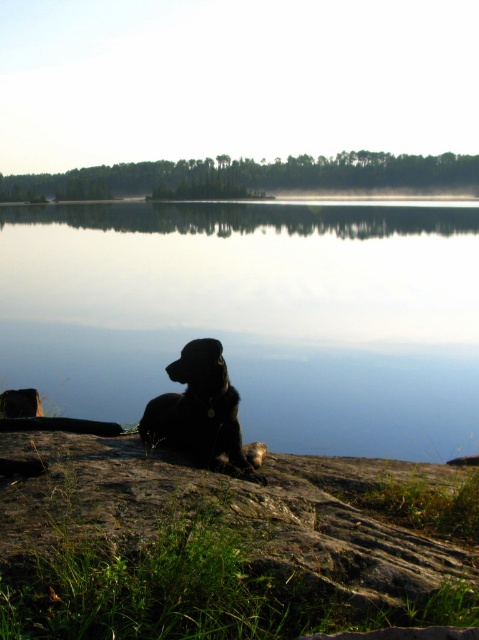
You are standing at the edge of the scene and want to place a small decorative stone on the ground so that it is visible above both the transparent water at center and the rough textured rock at lower center. Is this possible?

The transparent water at center is located above the rough textured rock at lower center, so placing a small decorative stone to be visible above both would require positioning it higher than the transparent water at center. However, since the water is at the center and the rock is below it, there is no higher ground available in the described scene to place the stone above both.

You are a photographer standing at the edge of the water. You want to take a photo of the black fur dog at lower center and the transparent water at center in the same frame. Can you position yourself so that both are visible without moving the dog?

The transparent water at center and black fur dog at lower center are 5.55 meters apart from each other. Since you are at the edge of the water, you can position yourself to include both in your frame as they are within a reasonable distance apart.